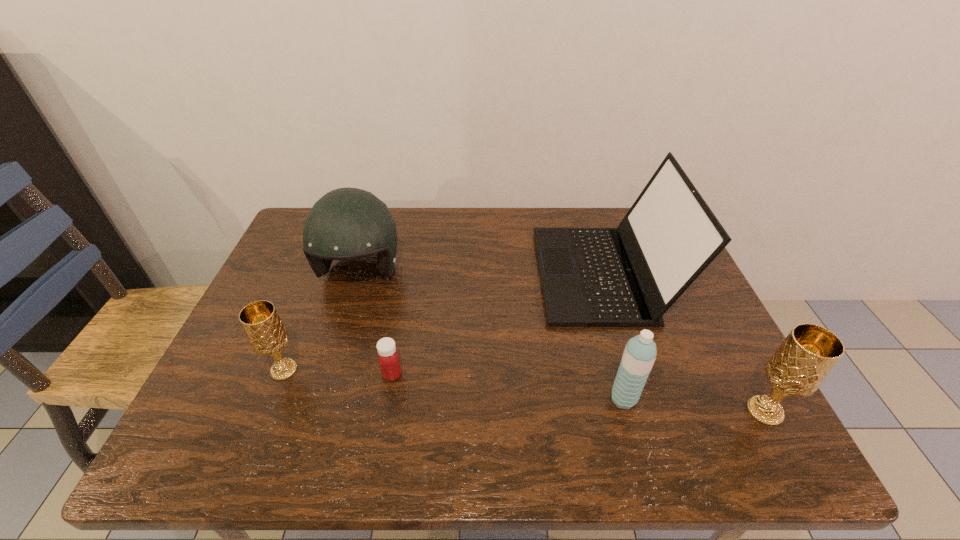
Identify the location of chalice that is at the left edge. The width and height of the screenshot is (960, 540). (266, 333).

At what (x,y) coordinates should I click in order to perform the action: click on football helmet present at the left edge. Please return your answer as a coordinate pair (x, y). Looking at the image, I should click on (346, 223).

Where is `chalice located at the right edge`? Image resolution: width=960 pixels, height=540 pixels. chalice located at the right edge is located at coordinates (802, 362).

Identify the location of laptop at the right edge. The width and height of the screenshot is (960, 540). (629, 276).

Where is `object that is at the far left corner`? object that is at the far left corner is located at coordinates (346, 223).

Locate an element on the screen. The width and height of the screenshot is (960, 540). object that is at the near left corner is located at coordinates (266, 333).

Where is `object that is at the far right corner`? object that is at the far right corner is located at coordinates (629, 276).

At what (x,y) coordinates should I click in order to perform the action: click on object positioned at the near right corner. Please return your answer as a coordinate pair (x, y). The image size is (960, 540). Looking at the image, I should click on (802, 362).

You are a GUI agent. You are given a task and a screenshot of the screen. Output one action in this format:
    pyautogui.click(x=<x>, y=<y>)
    Task: Click on the blank area at the far edge
    The height and width of the screenshot is (540, 960).
    Given the screenshot: What is the action you would take?
    pyautogui.click(x=556, y=222)

In the image, there is a desktop. Find the location of `vacant space at the near edge`. vacant space at the near edge is located at coordinates (365, 388).